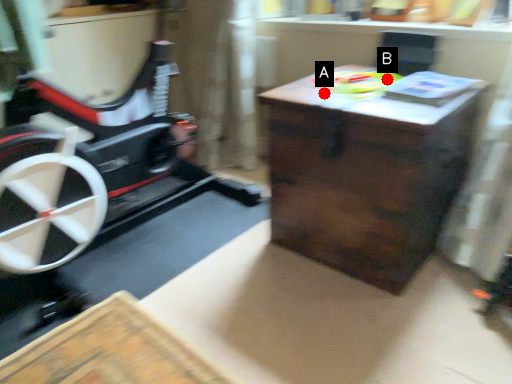
Question: Two points are circled on the image, labeled by A and B beside each circle. Which point appears closest to the camera in this image?

Choices:
 (A) A is closer
 (B) B is closer

Answer: (A)